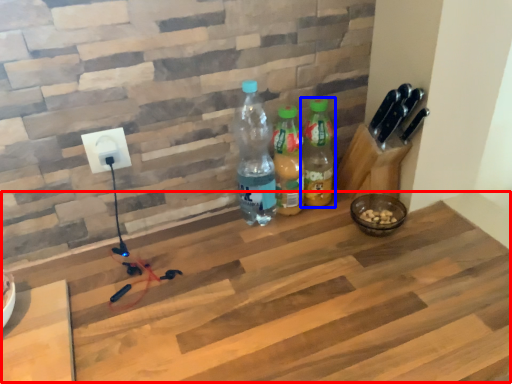
Question: Which point is closer to the camera, workbench (highlighted by a red box) or bottle (highlighted by a blue box)?

Choices:
 (A) workbench
 (B) bottle

Answer: (A)